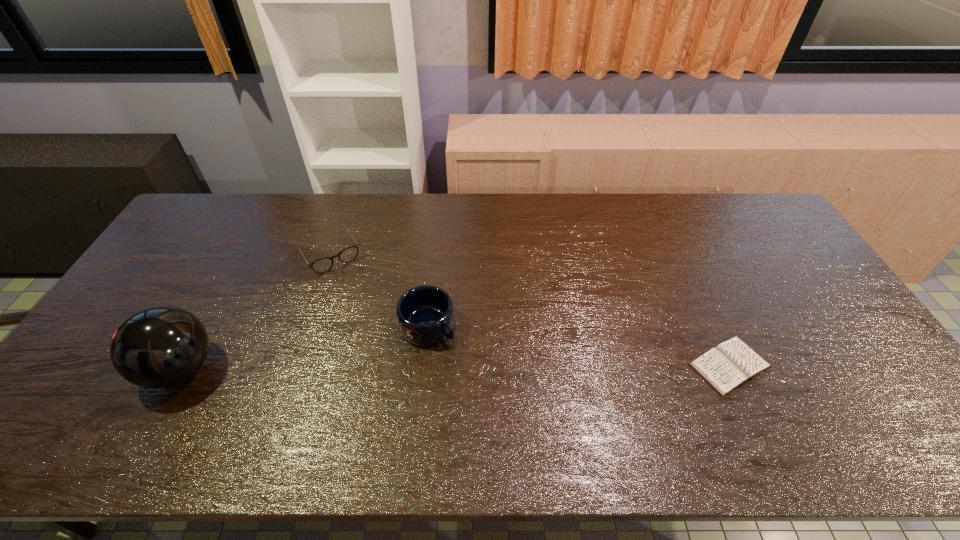
Locate an element on the screen. free space on the desktop that is between the tallest object and the shortest object and is positioned through the lenses of the farthest object is located at coordinates (405, 367).

Where is `vacant space on the desktop that is between the tallest object and the rightmost object and is positioned with the handle on the side of the mug`? Image resolution: width=960 pixels, height=540 pixels. vacant space on the desktop that is between the tallest object and the rightmost object and is positioned with the handle on the side of the mug is located at coordinates (481, 367).